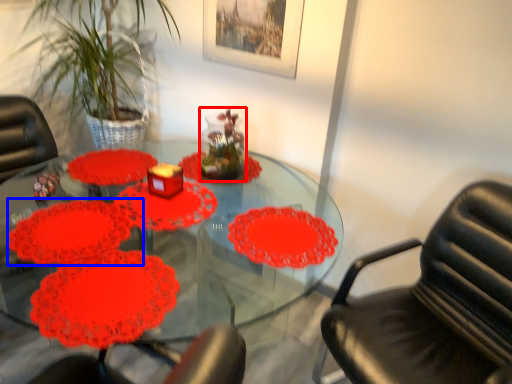
Question: Among these objects, which one is nearest to the camera, glass vase (highlighted by a red box) or flower (highlighted by a blue box)?

Choices:
 (A) glass vase
 (B) flower

Answer: (B)